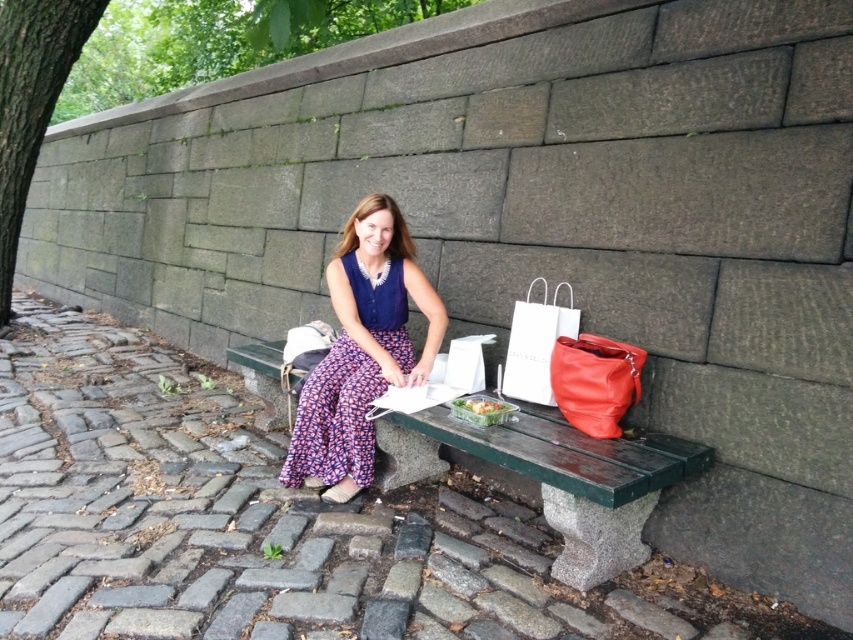
You are a delivery person who needs to place a small package that is 12 inches long on the ground between the green polished wood bench at center and the translucent plastic container at center. Can you fit the package horizontally between them?

The distance between the green polished wood bench at center and the translucent plastic container at center is 10.32 inches. Since the package is 12 inches long, it cannot fit horizontally between them as the space is shorter than the package length.

You are a photographer wanting to capture both the shiny leather bag at right and the white paper bag at right in the same frame. Given their positions, which bag should you focus on first to ensure both are in the shot?

The shiny leather bag at right is shorter than the white paper bag at right, so focusing on the white paper bag at right first would allow you to frame the taller bag and still include the shorter shiny leather bag at right in the shot.